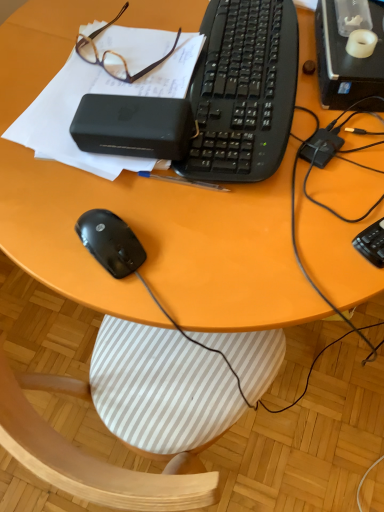
I want to click on free space in front of black plastic keyboard at center, the 2th computer keyboard from the right, so click(256, 218).